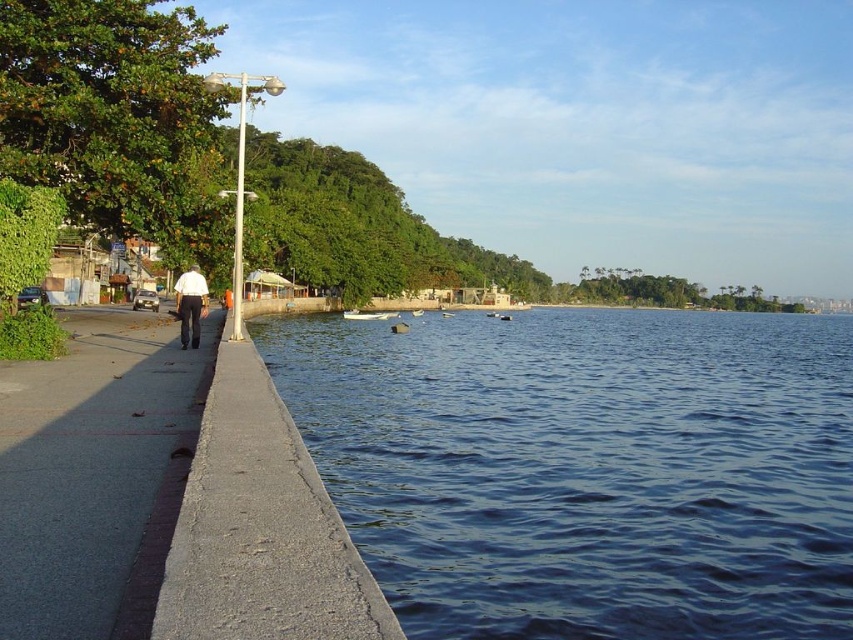
You are standing at the point marked by the coordinates point (x=238, y=209). Looking towards the direction the person is walking, which object is directly in front of you?

The metallic pole at left is represented by point (x=238, y=209), so if you are standing at that point and looking in the direction the person is walking, the metallic pole at left would be directly in front of you.

You are standing at the point marked as point (96,476). What surface are you currently standing on?

The point (96,476) is on gray concrete sidewalk at left, so you are standing on the gray concrete sidewalk at left.

You are standing on the gray concrete sidewalk at left and want to move to the white shirt at left. Which direction should you go to reach it?

The gray concrete sidewalk at left occupies less space than white shirt at left, so you should move towards the direction where the white shirt at left is located, which is to the left side of the frame.